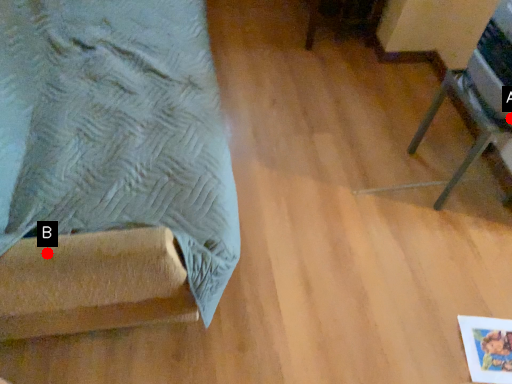
Question: Two points are circled on the image, labeled by A and B beside each circle. Which of the following is the farthest from the observer?

Choices:
 (A) A is further
 (B) B is further

Answer: (A)